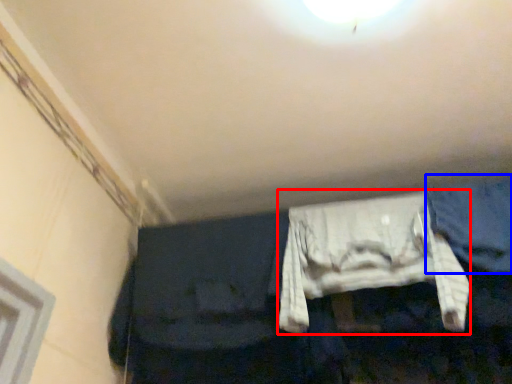
Question: Which of the following is the farthest to the observer, clothing (highlighted by a red box) or jeans (highlighted by a blue box)?

Choices:
 (A) clothing
 (B) jeans

Answer: (B)